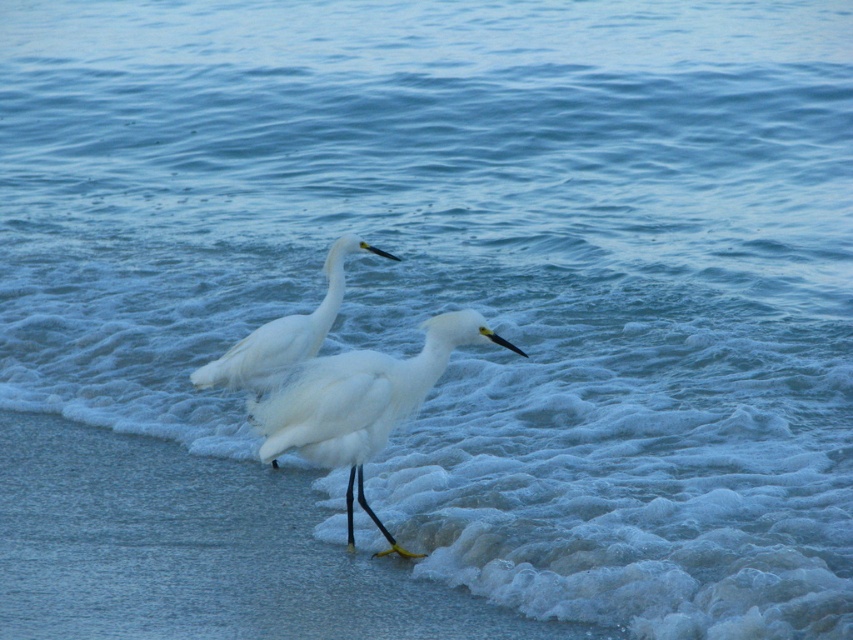
Does white fluffy bird at center appear under white feathered bird at center?

Yes.

The width and height of the screenshot is (853, 640). What do you see at coordinates (360, 403) in the screenshot?
I see `white fluffy bird at center` at bounding box center [360, 403].

Between point (448, 332) and point (209, 384), which one is positioned behind?

Point (209, 384)

Locate an element on the screen. white fluffy bird at center is located at coordinates (360, 403).